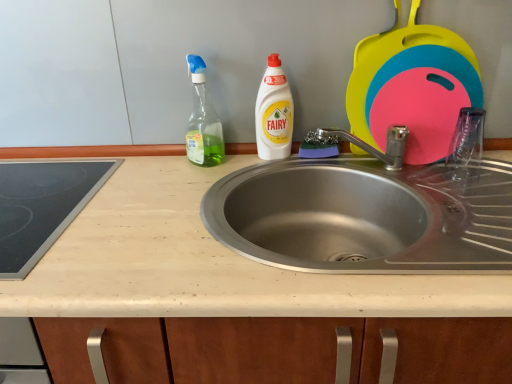
Find the location of a particular element. This screenshot has height=384, width=512. empty space that is to the right of green glass spray bottle at upper left, placed as the 1th cleaning product when sorted from left to right is located at coordinates (257, 163).